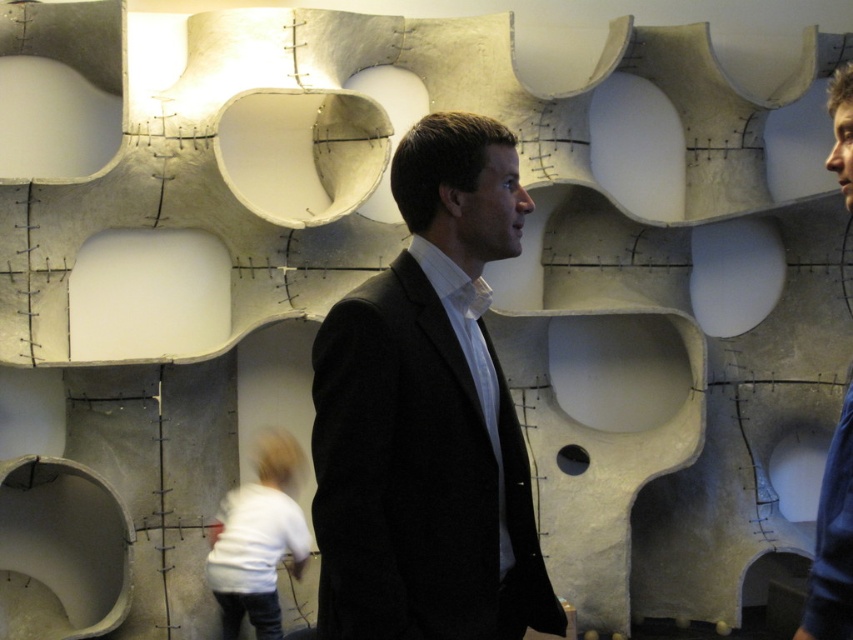
You are standing in front of the architectural structure and want to determine the relative positions of two points marked on the panels. Which point, point (403, 564) or point (827, 477), is closer to you?

Point (403, 564) is closer to you because it is further to the camera than point (827, 477).

Consider the image. You are standing in front of the architectural structure and want to approach both the black matte suit at center and the dark blue sweater at right. Which one should you move towards first to reach the closer one first?

You should move towards the black matte suit at center first because it is closer to you than the dark blue sweater at right.